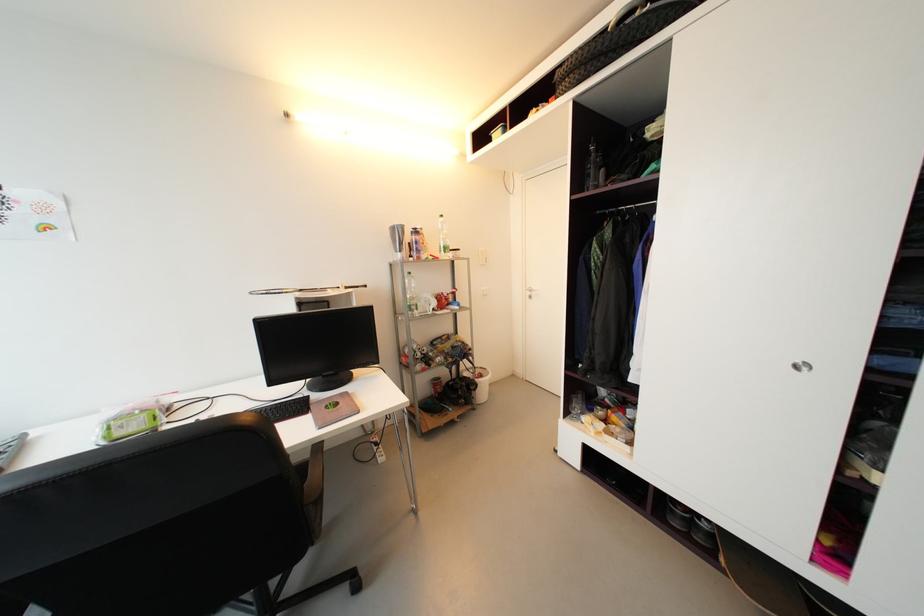
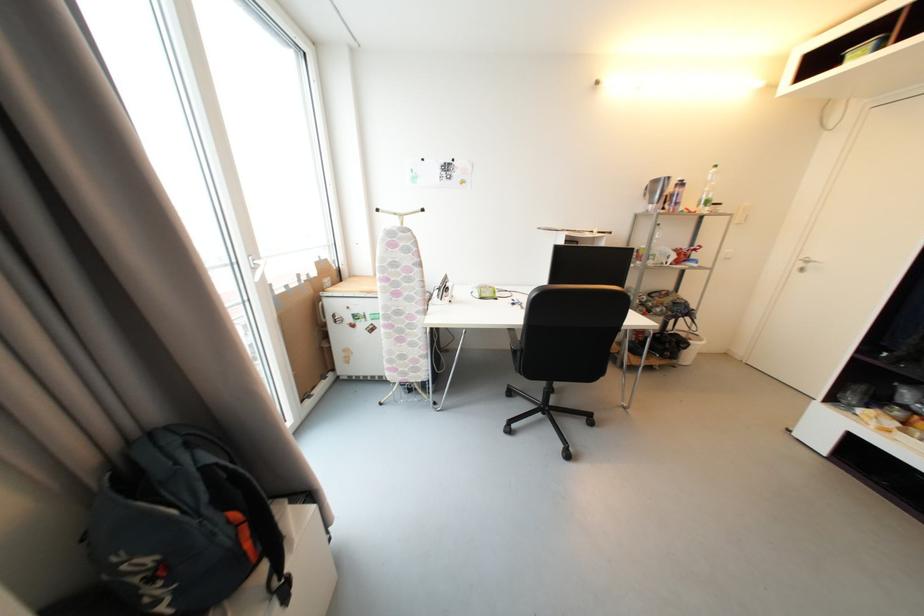
Question: The images are taken continuously from a first-person perspective. In which direction is your viewpoint rotating?

Choices:
 (A) Left
 (B) Right
 (C) Up
 (D) Down

Answer: (A)